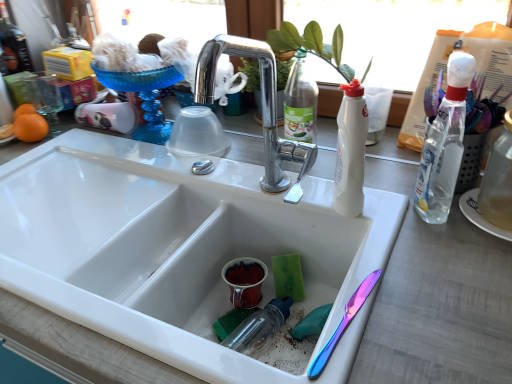
Where is `vacant space situated on the left part of white matte bottle at center, which appears as the 1th bottle when viewed from the left`? The width and height of the screenshot is (512, 384). vacant space situated on the left part of white matte bottle at center, which appears as the 1th bottle when viewed from the left is located at coordinates (273, 191).